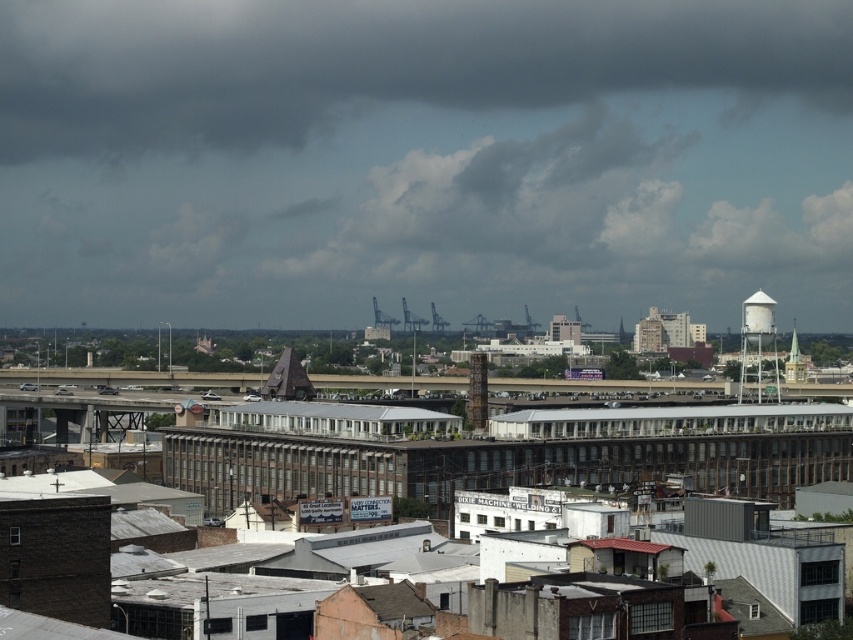
Question: From the image, what is the correct spatial relationship of dark gray cloud at upper center in relation to white matte water tower at upper right?

Choices:
 (A) below
 (B) above

Answer: (B)

Question: Is dark gray cloud at upper center positioned at the back of white matte water tower at upper right?

Choices:
 (A) no
 (B) yes

Answer: (B)

Question: Which point appears closest to the camera in this image?

Choices:
 (A) 524,77
 (B) 764,326

Answer: (B)

Question: Is dark gray cloud at upper center behind white matte water tower at upper right?

Choices:
 (A) yes
 (B) no

Answer: (A)